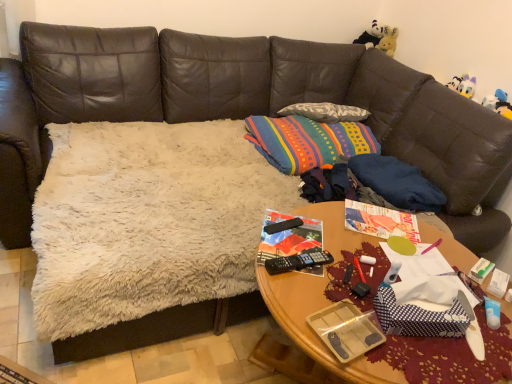
Question: Is blue dotted paper at center thinner than woodenobject at center?

Choices:
 (A) yes
 (B) no

Answer: (A)

Question: Is blue dotted paper at center outside of woodenobject at center?

Choices:
 (A) no
 (B) yes

Answer: (B)

Question: From the image's perspective, is blue dotted paper at center located beneath woodenobject at center?

Choices:
 (A) yes
 (B) no

Answer: (B)

Question: Considering the relative sizes of blue dotted paper at center and woodenobject at center in the image provided, is blue dotted paper at center shorter than woodenobject at center?

Choices:
 (A) yes
 (B) no

Answer: (A)

Question: Can you confirm if blue dotted paper at center is wider than woodenobject at center?

Choices:
 (A) yes
 (B) no

Answer: (B)

Question: From a real-world perspective, is blue dotted paper at center below woodenobject at center?

Choices:
 (A) yes
 (B) no

Answer: (B)

Question: Is clear plastic tray at center positioned with its back to woodenobject at center?

Choices:
 (A) no
 (B) yes

Answer: (A)

Question: Is clear plastic tray at center not inside woodenobject at center?

Choices:
 (A) no
 (B) yes

Answer: (A)

Question: Is clear plastic tray at center smaller than woodenobject at center?

Choices:
 (A) no
 (B) yes

Answer: (B)

Question: From the image's perspective, would you say clear plastic tray at center is shown under woodenobject at center?

Choices:
 (A) yes
 (B) no

Answer: (B)

Question: Is clear plastic tray at center wider than woodenobject at center?

Choices:
 (A) yes
 (B) no

Answer: (B)

Question: Is clear plastic tray at center with woodenobject at center?

Choices:
 (A) no
 (B) yes

Answer: (A)

Question: Can you confirm if blue dotted paper at center is wider than black plastic remote control at center?

Choices:
 (A) yes
 (B) no

Answer: (A)